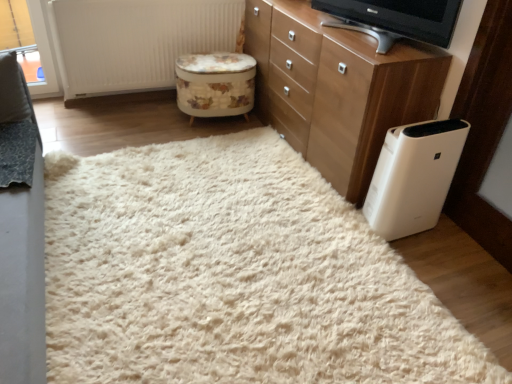
Question: Is wooden chest of drawers at upper right wider or thinner than matte black television at upper center?

Choices:
 (A) wide
 (B) thin

Answer: (A)

Question: Is wooden chest of drawers at upper right in front of or behind matte black television at upper center in the image?

Choices:
 (A) front
 (B) behind

Answer: (B)

Question: Which of these objects is positioned closest to the white fluffy rug at center?

Choices:
 (A) white textured radiator at upper center
 (B) wooden chest of drawers at upper right
 (C) white plastic air purifier at lower right
 (D) matte black television at upper center
 (E) floral fabric ottoman at center

Answer: (C)

Question: Estimate the real-world distances between objects in this image. Which object is closer to the white textured radiator at upper center?

Choices:
 (A) white fluffy rug at center
 (B) wooden chest of drawers at upper right
 (C) matte black television at upper center
 (D) white plastic air purifier at lower right
 (E) floral fabric ottoman at center

Answer: (E)